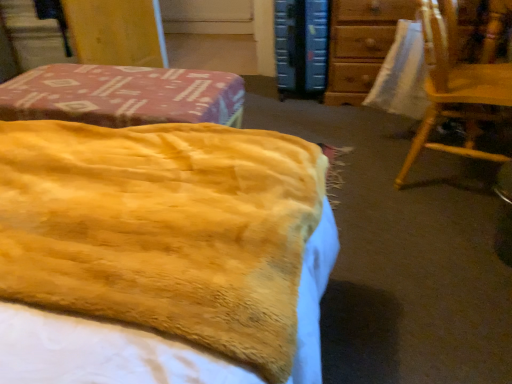
I want to click on vacant area that is in front of blue hardcover book at upper center, so click(x=334, y=112).